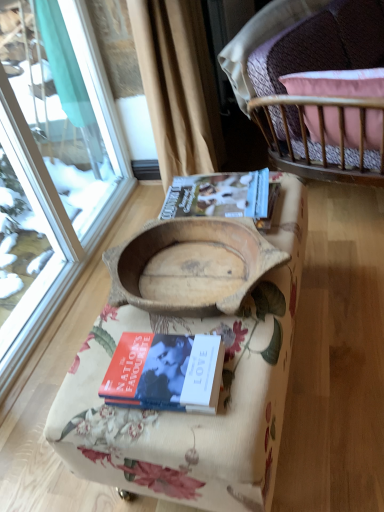
At what (x,y) coordinates should I click in order to perform the action: click on spots to the right of hardcover book at center, the first book in the front-to-back sequence. Please return your answer as a coordinate pair (x, y). This screenshot has width=384, height=512. Looking at the image, I should click on (246, 354).